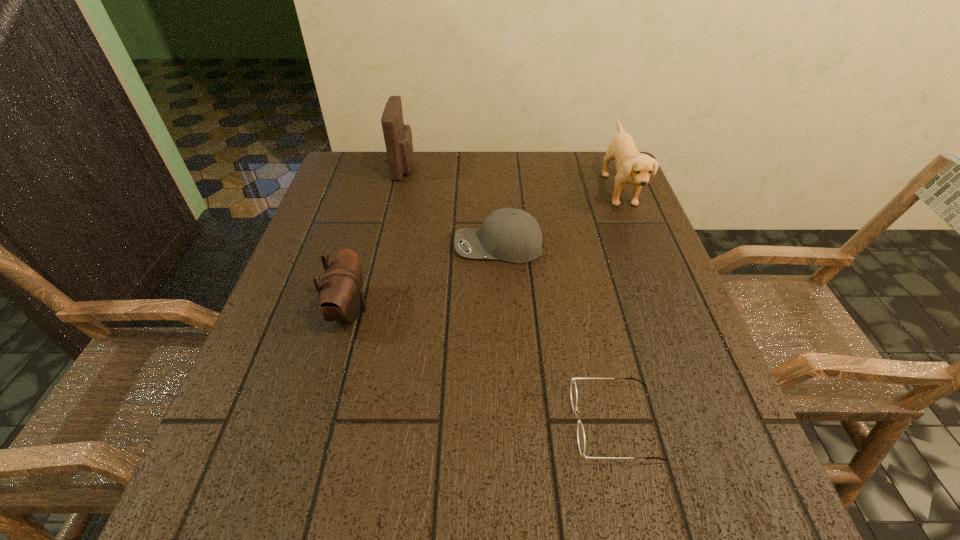
Image resolution: width=960 pixels, height=540 pixels. What are the coordinates of `the farther pouch` in the screenshot? It's located at (398, 137).

The width and height of the screenshot is (960, 540). Find the location of `puppy`. puppy is located at coordinates tap(632, 167).

You are a GUI agent. You are given a task and a screenshot of the screen. Output one action in this format:
    pyautogui.click(x=<x>, y=<y>)
    Task: Click on the fourth farthest object
    
    Given the screenshot: What is the action you would take?
    pyautogui.click(x=341, y=297)

Image resolution: width=960 pixels, height=540 pixels. I want to click on the nearer pouch, so click(x=341, y=297).

I want to click on baseball cap, so click(512, 235).

This screenshot has width=960, height=540. In order to click on the third object from left to right in this screenshot , I will do (512, 235).

Where is `the shortest object`? The image size is (960, 540). the shortest object is located at coordinates (573, 390).

Locate an element on the screen. the nearest object is located at coordinates (573, 390).

At what (x,y) coordinates should I click in order to perform the action: click on vacant region located 0.310m with an open flap on the taller pouch. Please return your answer as a coordinate pair (x, y). This screenshot has height=540, width=960. Looking at the image, I should click on (524, 168).

Locate an element on the screen. vacant space situated on the left side of the rightmost object is located at coordinates (548, 190).